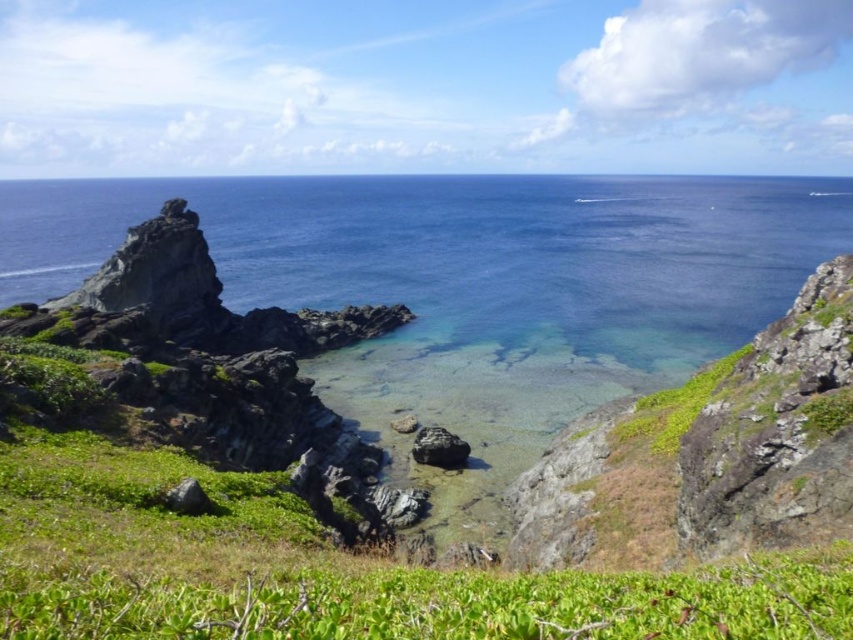
Question: Which point appears closest to the camera in this image?

Choices:
 (A) (196, 509)
 (B) (422, 428)
 (C) (645, 614)

Answer: (C)

Question: Does green leafy grass at lower center appear under smooth gray rock at center?

Choices:
 (A) no
 (B) yes

Answer: (A)

Question: Is green leafy grass at lower center thinner than green leafy grass at lower right?

Choices:
 (A) no
 (B) yes

Answer: (A)

Question: Which object appears farthest from the camera in this image?

Choices:
 (A) green leafy grass at lower center
 (B) green leafy grass at lower right

Answer: (B)

Question: Can you confirm if green leafy grass at lower center is smaller than green leafy grass at lower right?

Choices:
 (A) no
 (B) yes

Answer: (B)

Question: Which of the following is the closest to the observer?

Choices:
 (A) gray rock at lower left
 (B) green leafy grass at lower center

Answer: (B)